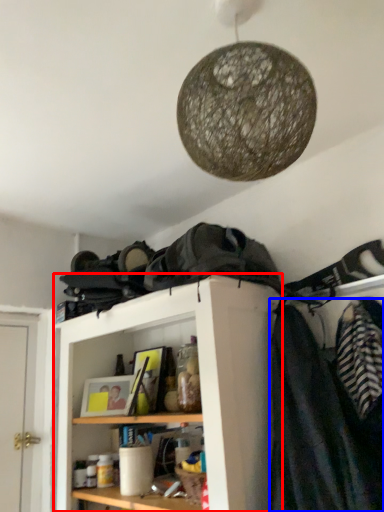
Question: Which point is closer to the camera, shelf (highlighted by a red box) or clothing (highlighted by a blue box)?

Choices:
 (A) shelf
 (B) clothing

Answer: (B)